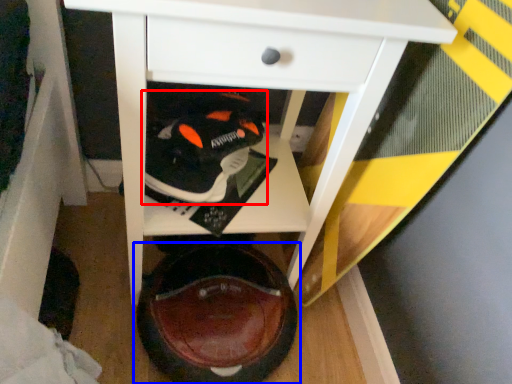
Question: Which object is closer to the camera taking this photo, footwear (highlighted by a red box) or footwear (highlighted by a blue box)?

Choices:
 (A) footwear
 (B) footwear

Answer: (B)